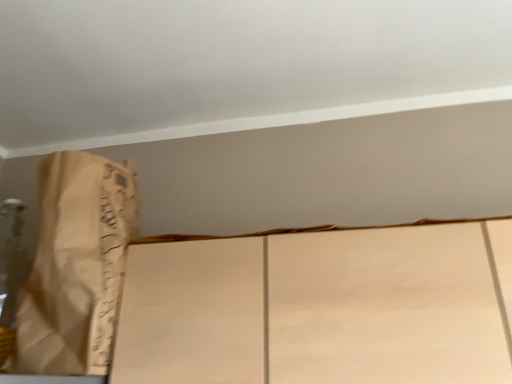
What are the coordinates of `brown paper bag at left` in the screenshot? It's located at tap(76, 265).

This screenshot has height=384, width=512. What do you see at coordinates (76, 265) in the screenshot?
I see `brown paper bag at left` at bounding box center [76, 265].

Locate an element on the screen. This screenshot has width=512, height=384. brown paper bag at left is located at coordinates click(x=76, y=265).